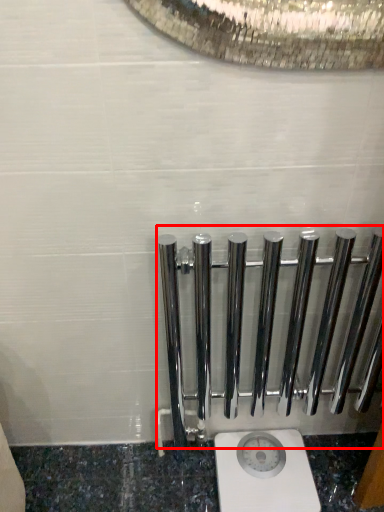
Question: Observing the image, what is the correct spatial positioning of rail (annotated by the red box) in reference to toilet?

Choices:
 (A) right
 (B) left

Answer: (A)